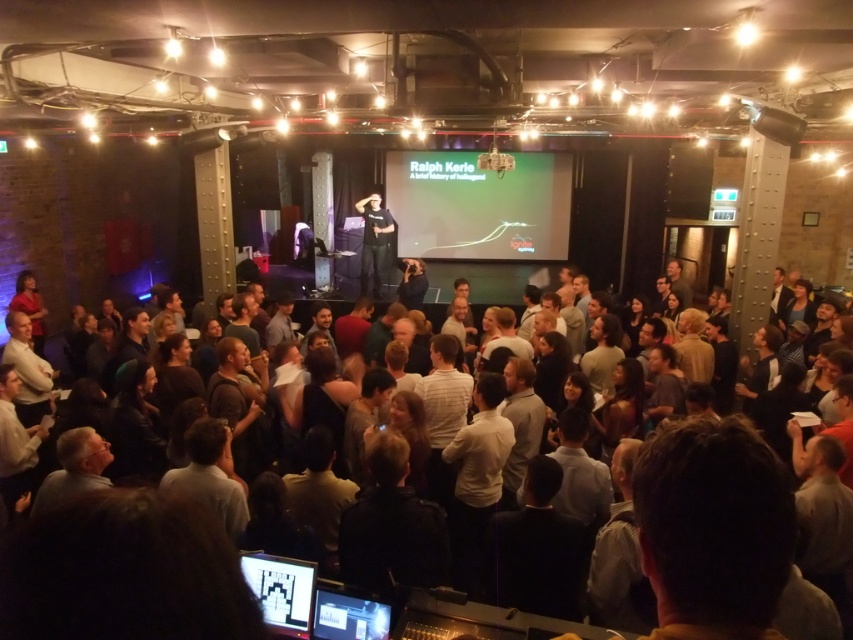
Question: Which object is the closest to the gray fabric jacket at lower left?

Choices:
 (A) matte black screen at lower center
 (B) light brown leather jacket at lower center
 (C) dark brown leather jacket at center
 (D) matte black monitor at lower center

Answer: (B)

Question: Can you confirm if gray fabric jacket at lower left is positioned above matte red shirt at lower left?

Choices:
 (A) yes
 (B) no

Answer: (B)

Question: Which point is closer to the camera taking this photo?

Choices:
 (A) (689, 458)
 (B) (189, 476)
 (C) (347, 580)

Answer: (A)

Question: Is dark brown leather jacket at center further to camera compared to dark brown hair at center?

Choices:
 (A) no
 (B) yes

Answer: (A)

Question: Which of the following is the farthest from the observer?

Choices:
 (A) (361, 522)
 (B) (309, 576)

Answer: (A)

Question: Is dark brown hair at center positioned before light brown leather jacket at lower center?

Choices:
 (A) yes
 (B) no

Answer: (A)